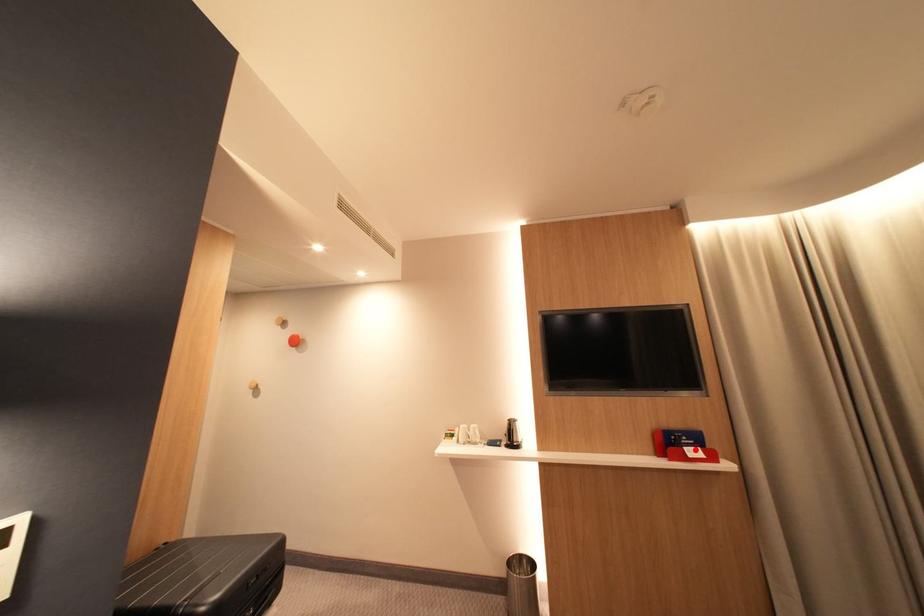
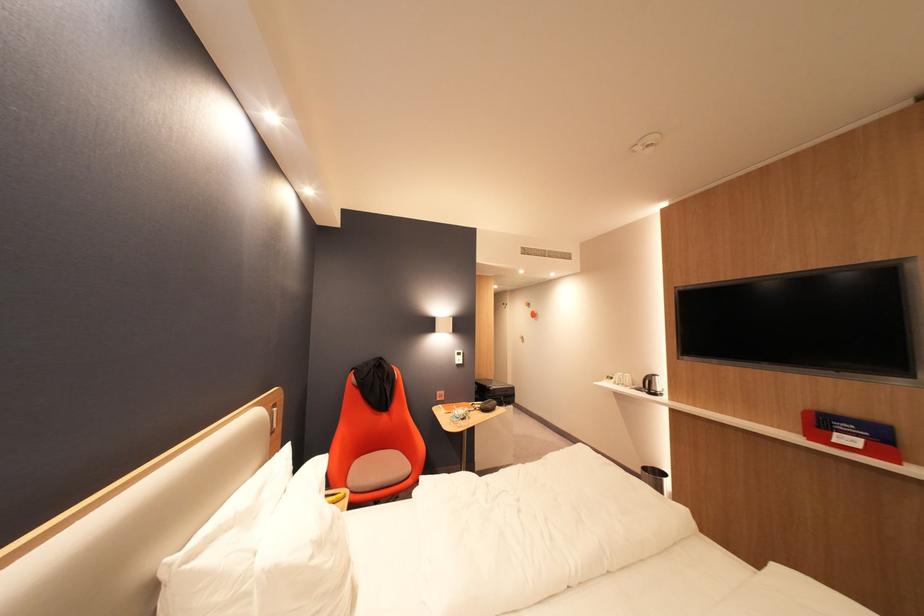
Find the pixel in the second image that matches the highlighted location in the first image.

(846, 435)